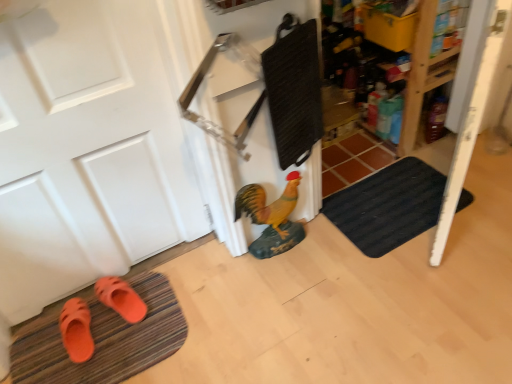
You are a GUI agent. You are given a task and a screenshot of the screen. Output one action in this format:
    pyautogui.click(x=<x>, y=<y>)
    Task: Click on the blank space situated above orange rubber bath mat at lower left, which appears as the second bath mat when viewed from the top (from a real-world perspective)
    Image resolution: width=512 pixels, height=384 pixels.
    Given the screenshot: What is the action you would take?
    pyautogui.click(x=94, y=335)